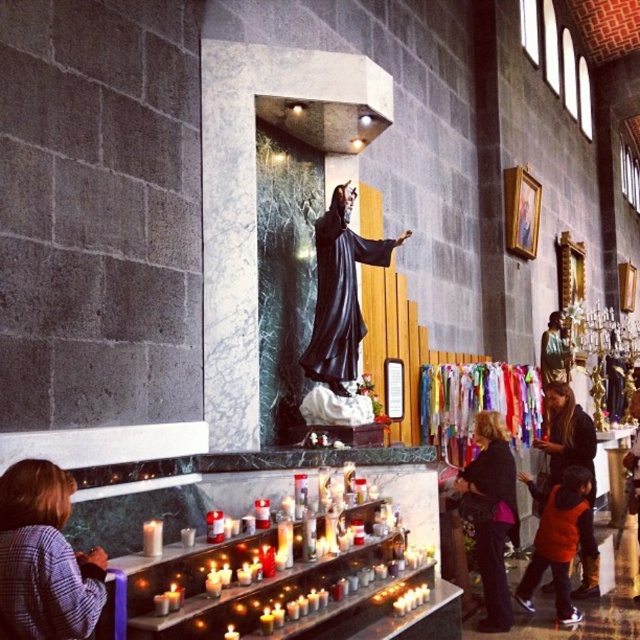
You are standing in the church and want to place a new candle on the tiered shelf in front of the altar. However, you need to avoid the plaid shirt at lower left. Where should you place the candle?

The plaid shirt at lower left is located at point [44,557], so you should place the candle away from that coordinate on the tiered shelf to avoid it.